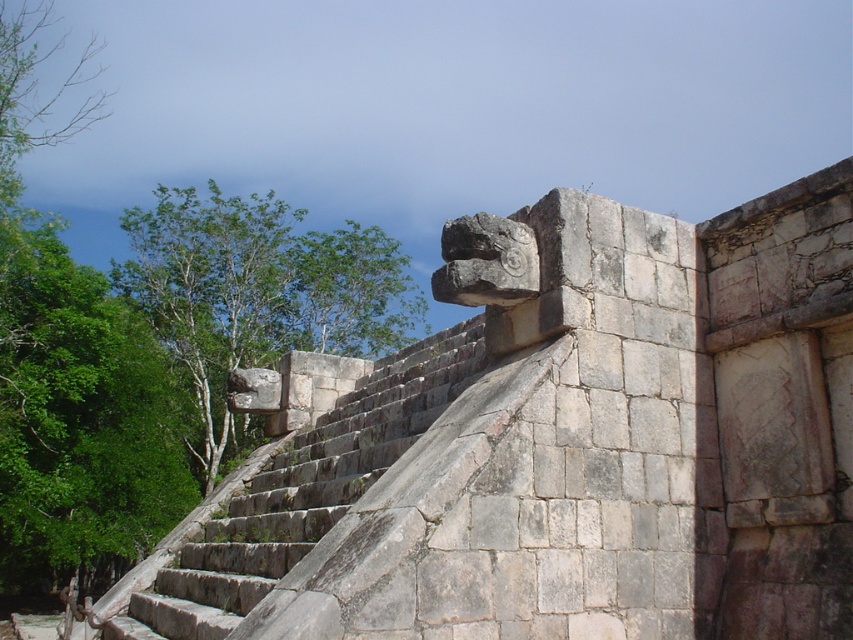
Question: Which object is closer to the camera taking this photo?

Choices:
 (A) green leafy tree at left
 (B) gray stone carving at upper center
 (C) gray stone stairs at upper center

Answer: (B)

Question: Which point is closer to the camera?

Choices:
 (A) gray stone stairs at upper center
 (B) green leafy tree at left
 (C) gray stone carving at upper center

Answer: (C)

Question: Which object appears farthest from the camera in this image?

Choices:
 (A) gray stone carving at upper center
 (B) green leafy tree at left

Answer: (B)

Question: Is gray stone carving at upper center thinner than green leafy tree at left?

Choices:
 (A) yes
 (B) no

Answer: (A)

Question: Is gray stone carving at upper center wider than green leafy tree at left?

Choices:
 (A) yes
 (B) no

Answer: (B)

Question: Does gray stone carving at upper center appear over green leafy tree at left?

Choices:
 (A) no
 (B) yes

Answer: (A)